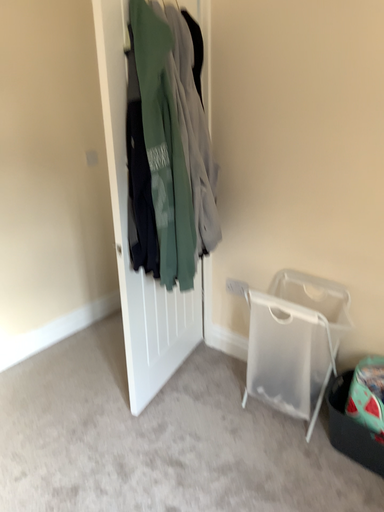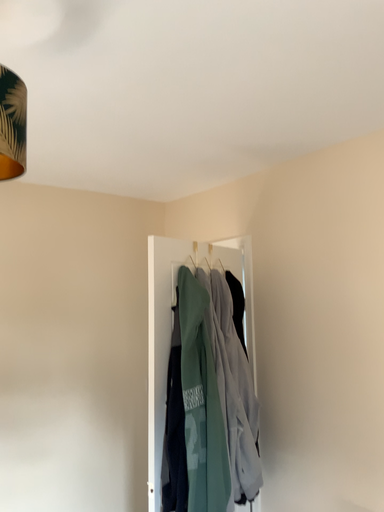
Question: How did the camera likely rotate when shooting the video?

Choices:
 (A) rotated upward
 (B) rotated downward

Answer: (A)